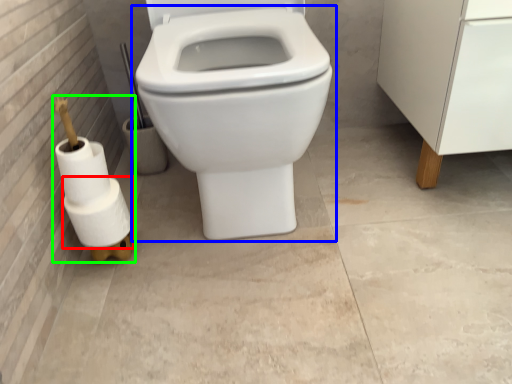
Question: Considering the real-world distances, which object is farthest from toilet paper (highlighted by a red box)? toilet (highlighted by a blue box) or toilet paper (highlighted by a green box)?

Choices:
 (A) toilet
 (B) toilet paper

Answer: (A)